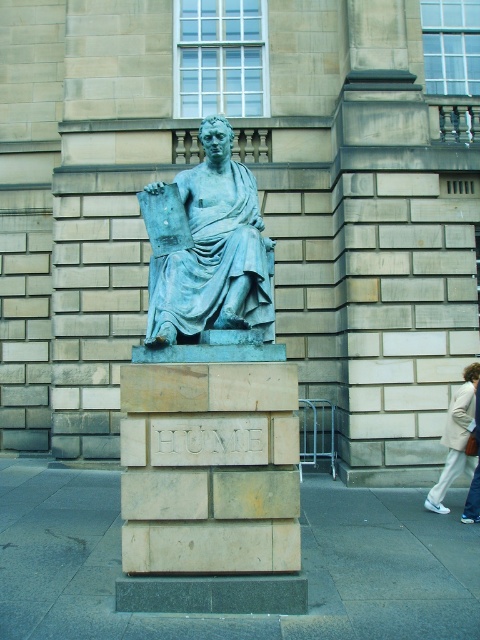
Question: Among these points, which one is farthest from the camera?

Choices:
 (A) (216, 182)
 (B) (457, 460)

Answer: (B)

Question: Is green patina statue at center to the left of light beige pants at lower right from the viewer's perspective?

Choices:
 (A) yes
 (B) no

Answer: (A)

Question: Which object is farther from the camera taking this photo?

Choices:
 (A) green patina statue at center
 (B) light beige pants at lower right

Answer: (B)

Question: Observing the image, what is the correct spatial positioning of green patina statue at center in reference to light beige pants at lower right?

Choices:
 (A) right
 (B) left

Answer: (B)

Question: Can you confirm if green patina statue at center is positioned above light beige pants at lower right?

Choices:
 (A) no
 (B) yes

Answer: (B)